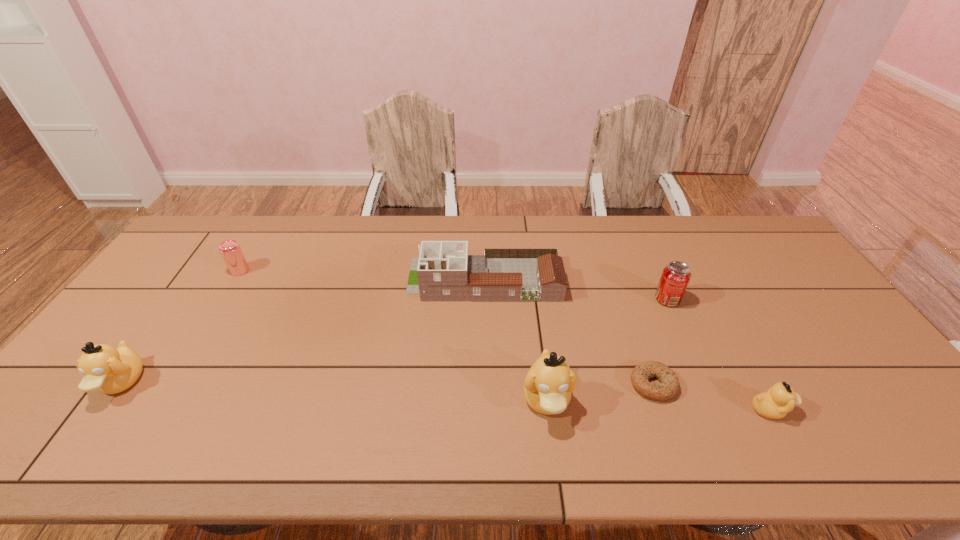
The width and height of the screenshot is (960, 540). In order to click on object that is at the near left corner in this screenshot , I will do `click(109, 370)`.

Find the location of a particular element. This screenshot has height=540, width=960. free spot at the far edge of the desktop is located at coordinates (347, 240).

Locate an element on the screen. The image size is (960, 540). blank area at the near edge is located at coordinates (674, 409).

Locate an element on the screen. The height and width of the screenshot is (540, 960). free location at the left edge is located at coordinates (182, 285).

Locate an element on the screen. This screenshot has height=540, width=960. free point at the far left corner is located at coordinates (231, 237).

The height and width of the screenshot is (540, 960). I want to click on vacant space at the near right corner, so click(x=884, y=394).

Locate an element on the screen. The height and width of the screenshot is (540, 960). unoccupied position between the shortest duckling and the bagel is located at coordinates (712, 397).

Locate an element on the screen. The image size is (960, 540). free area in between the second duckling from left to right and the dollhouse is located at coordinates pyautogui.click(x=516, y=340).

You are a GUI agent. You are given a task and a screenshot of the screen. Output one action in this format:
    pyautogui.click(x=<x>, y=<y>)
    Task: Click on the vacant area that lies between the dollhouse and the rightmost object
    The width and height of the screenshot is (960, 540).
    Given the screenshot: What is the action you would take?
    pyautogui.click(x=628, y=345)

Where is `free space between the second duckling from right to left and the dollhouse`? The width and height of the screenshot is (960, 540). free space between the second duckling from right to left and the dollhouse is located at coordinates (516, 340).